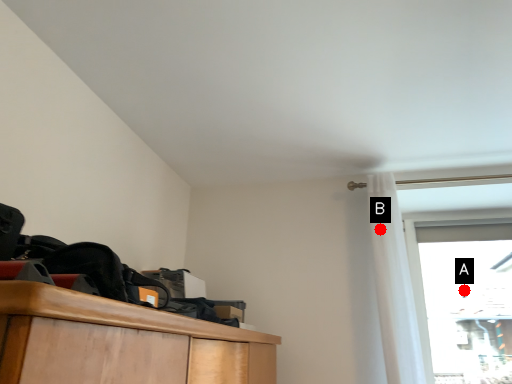
Question: Two points are circled on the image, labeled by A and B beside each circle. Which point is closer to the camera?

Choices:
 (A) A is closer
 (B) B is closer

Answer: (B)